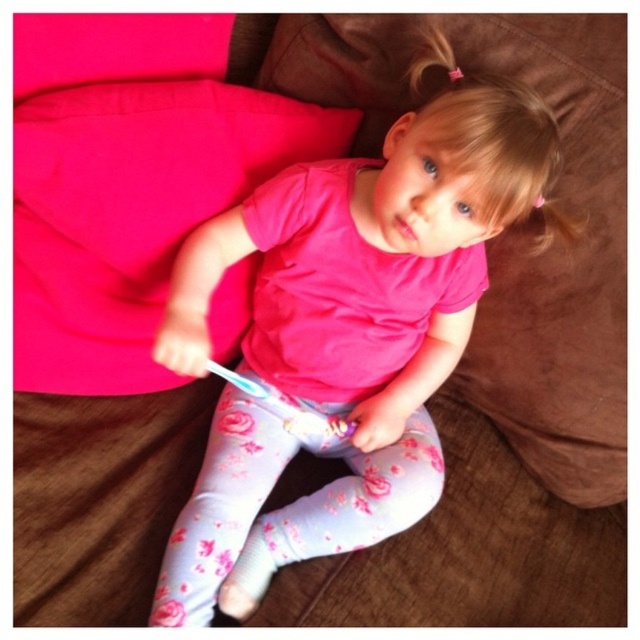
You are a parent observing your child sitting on the couch. You have a small toy that is 6 inches long. Can you place the toy between the pink matte shirt at center and the white plastic toothbrush at lower center without it overlapping either object?

The pink matte shirt at center and white plastic toothbrush at lower center are 7.11 inches apart. Since the toy is 6 inches long, there is enough space between them to place the toy without overlapping either object.

You are a photographer standing at the camera position. You want to take a closeup shot of the child. The camera is 34.33 inches away from point (339,524). If the child is sitting on the brown couch, where should you position the camera to focus on the child?

The camera should be positioned 34.33 inches away from point (339,524) to focus on the child sitting on the brown couch.

Where is the pink matte shirt at center located in the image?

The pink matte shirt at center is located at point coordinates of (346, 330).